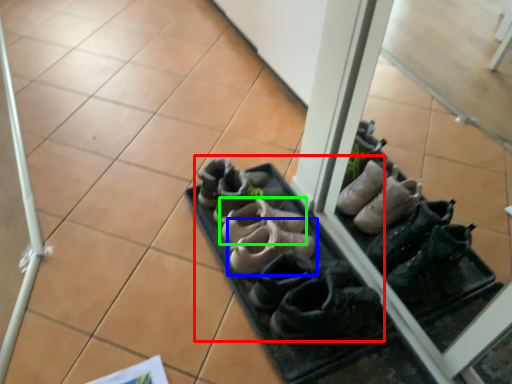
Question: Which is nearer to the footwear (highlighted by a red box)? footwear (highlighted by a blue box) or footwear (highlighted by a green box).

Choices:
 (A) footwear
 (B) footwear

Answer: (A)